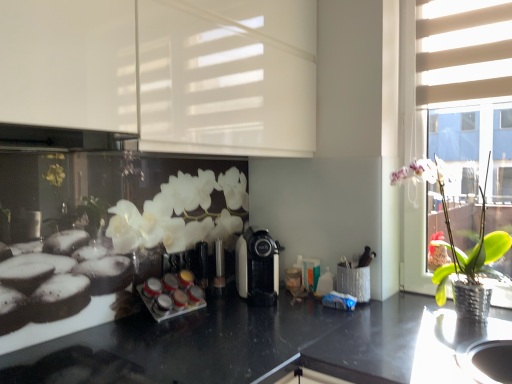
Question: Relative to beige fabric blinds at upper right, the 1th shutter positioned from the right, is green leafy plant in metallic pot at right in front or behind?

Choices:
 (A) front
 (B) behind

Answer: (A)

Question: In terms of width, does green leafy plant in metallic pot at right look wider or thinner when compared to beige fabric blinds at upper right, the 1th shutter positioned from the right?

Choices:
 (A) thin
 (B) wide

Answer: (B)

Question: Based on their relative distances, which object is farther from the green leafy plant in metallic pot at right?

Choices:
 (A) white glossy cabinet at upper left, acting as the first shutter starting from the left
 (B) white glossy spice rack at center
 (C) black plastic coffee machine at center
 (D) beige fabric blinds at upper right, which is the 2th shutter from left to right

Answer: (B)

Question: Estimate the real-world distances between objects in this image. Which object is farther from the white glossy cabinet at upper left, acting as the first shutter starting from the left?

Choices:
 (A) beige fabric blinds at upper right, which is the 2th shutter from left to right
 (B) white glossy spice rack at center
 (C) green leafy plant in metallic pot at right
 (D) black plastic coffee machine at center

Answer: (B)